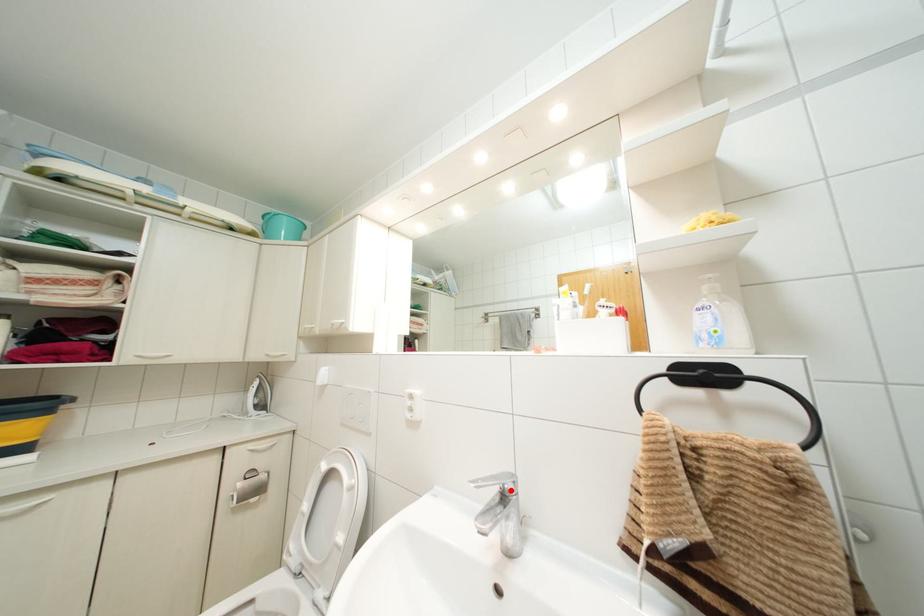
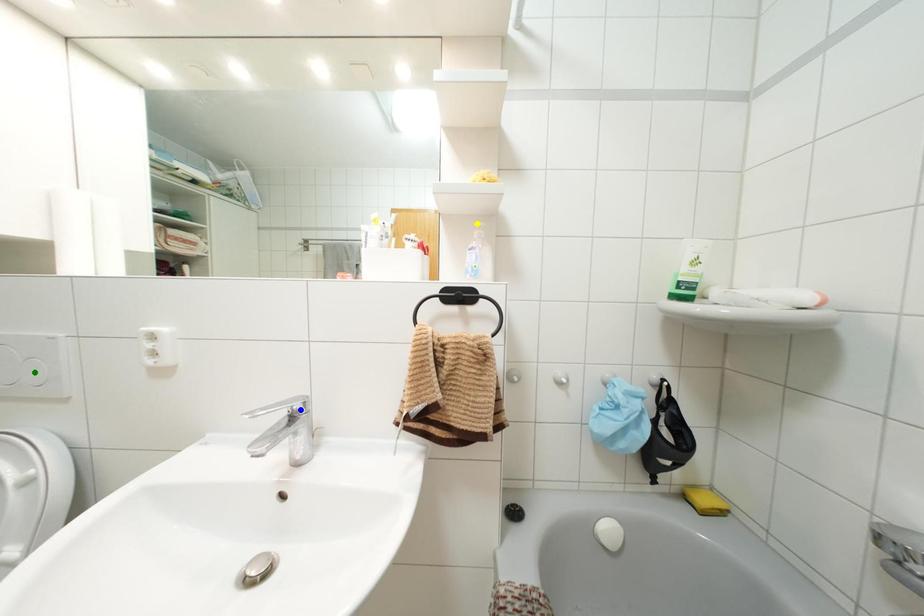
Question: I am providing you with two images of the same scene from different viewpoints. A red point is marked on the first image. You are given multiple points on the second image. In image 2, which mark is for the same physical point as the one in image 1?

Choices:
 (A) green point
 (B) blue point
 (C) yellow point

Answer: (B)